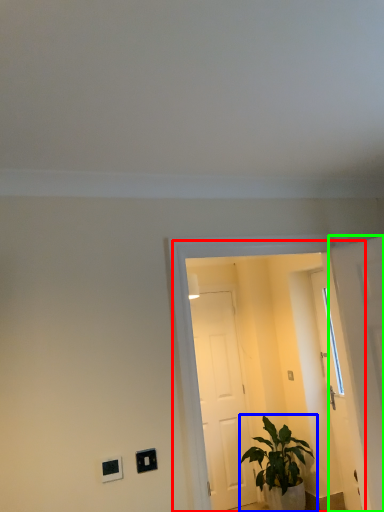
Question: Estimate the real-world distances between objects in this image. Which object is farther from glass door (highlighted by a red box), houseplant (highlighted by a blue box) or door (highlighted by a green box)?

Choices:
 (A) houseplant
 (B) door

Answer: (B)